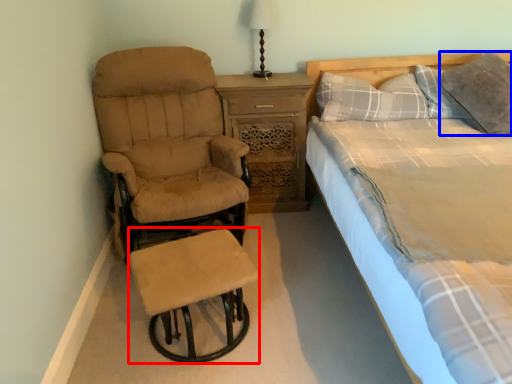
Question: Which object is closer to the camera taking this photo, bar stool (highlighted by a red box) or pillow (highlighted by a blue box)?

Choices:
 (A) bar stool
 (B) pillow

Answer: (A)